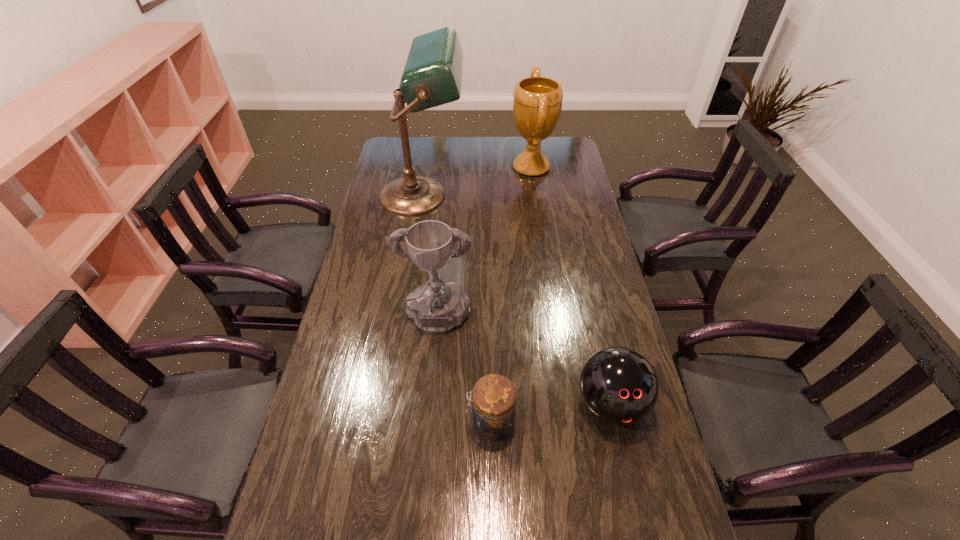
Find the location of a particular element. This screenshot has height=540, width=960. table lamp is located at coordinates (432, 76).

Where is `the right award`? The width and height of the screenshot is (960, 540). the right award is located at coordinates (537, 103).

Locate an element on the screen. This screenshot has height=540, width=960. the left award is located at coordinates (436, 307).

Locate an element on the screen. The height and width of the screenshot is (540, 960). the third nearest object is located at coordinates (436, 307).

In order to click on the fourth tallest object in this screenshot , I will do `click(620, 386)`.

The image size is (960, 540). Identify the location of jar. (493, 411).

Find the location of a particular element. Image resolution: width=960 pixels, height=540 pixels. blank space located 0.260m above the green lampshade of the table lamp is located at coordinates (529, 197).

Locate an element on the screen. This screenshot has height=540, width=960. free space located on the front of the right award with the decoration is located at coordinates (471, 167).

You are a GUI agent. You are given a task and a screenshot of the screen. Output one action in this format:
    pyautogui.click(x=<x>, y=<y>)
    Task: Click on the free space located on the front of the right award with the decoration
    The image size is (960, 540).
    Given the screenshot: What is the action you would take?
    pyautogui.click(x=493, y=167)

This screenshot has width=960, height=540. Identify the location of vacant space located on the front of the right award with the decoration. (487, 167).